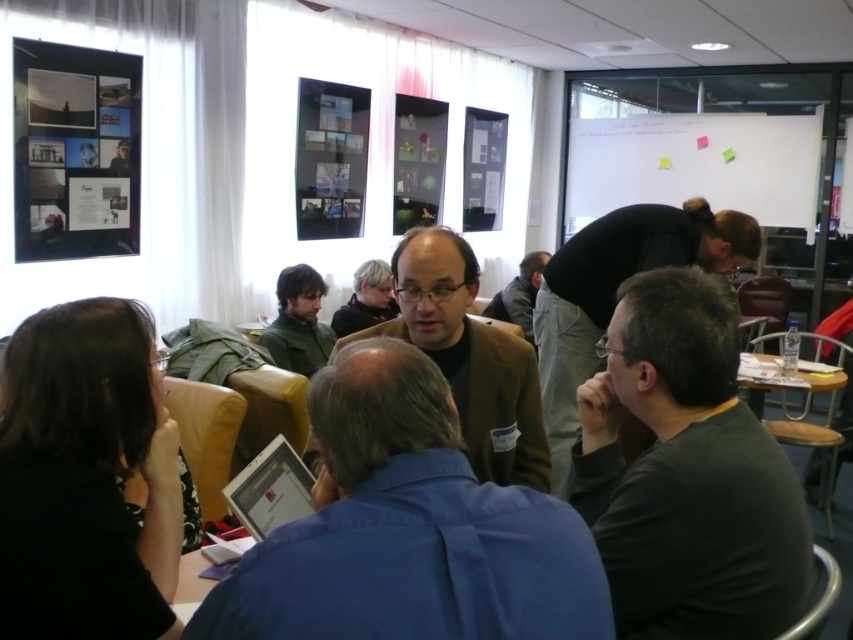
Question: Which of the following is the closest to the observer?

Choices:
 (A) dark gray sweater at center
 (B) matte brown jacket at center

Answer: (A)

Question: Which of the following is the farthest from the observer?

Choices:
 (A) (477, 564)
 (B) (512, 472)

Answer: (B)

Question: Does dark gray sweater at center have a smaller size compared to wooden table at lower right?

Choices:
 (A) yes
 (B) no

Answer: (A)

Question: Can you confirm if wooden table at lower right is bigger than matte brown jacket at center?

Choices:
 (A) yes
 (B) no

Answer: (A)

Question: Among these objects, which one is nearest to the camera?

Choices:
 (A) dark gray sweater at center
 (B) green fabric jacket at center
 (C) blue fabric shirt at center
 (D) wooden table at lower right

Answer: (C)

Question: Is dark gray shirt at center positioned behind dark brown leather jacket at center?

Choices:
 (A) yes
 (B) no

Answer: (B)